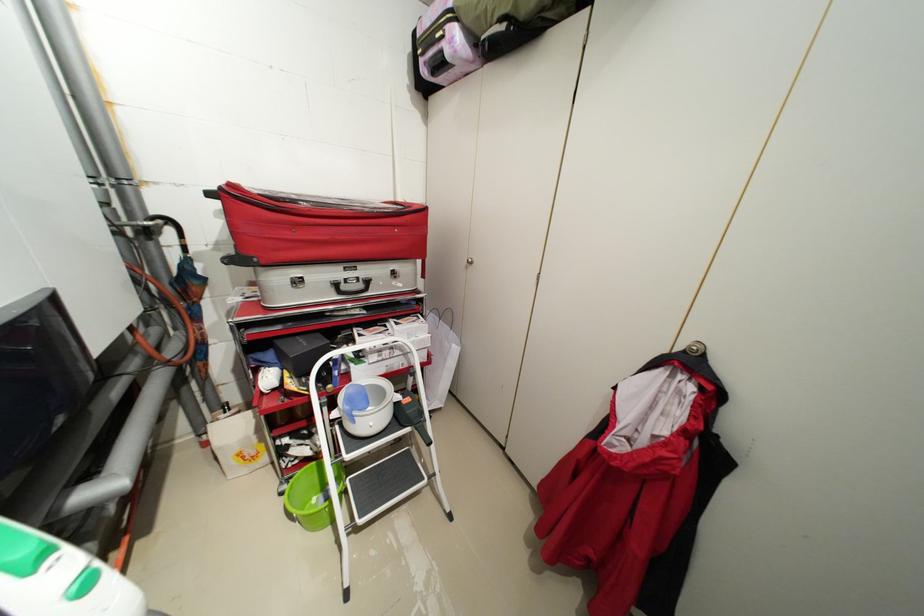
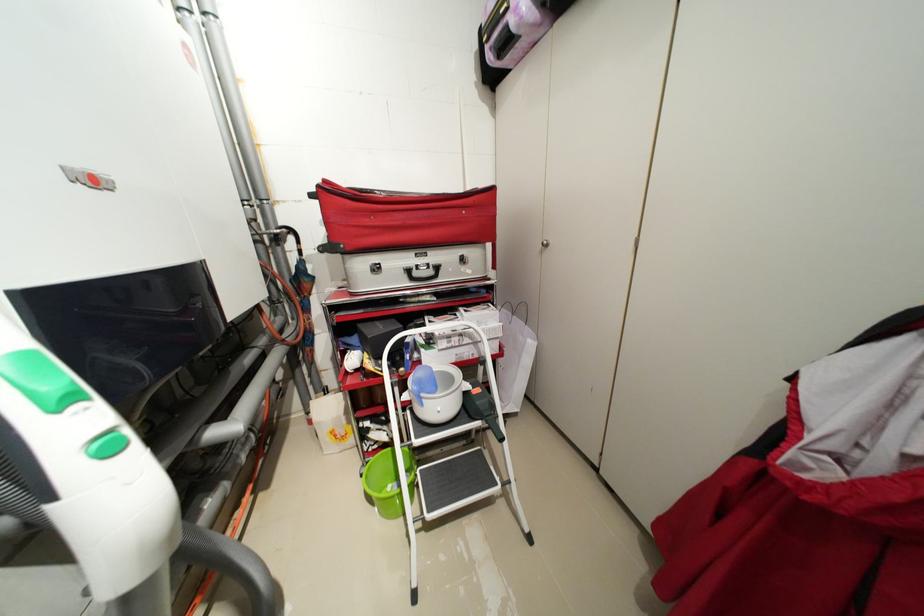
The point at (350, 288) is marked in the first image. Where is the corresponding point in the second image?

(422, 275)